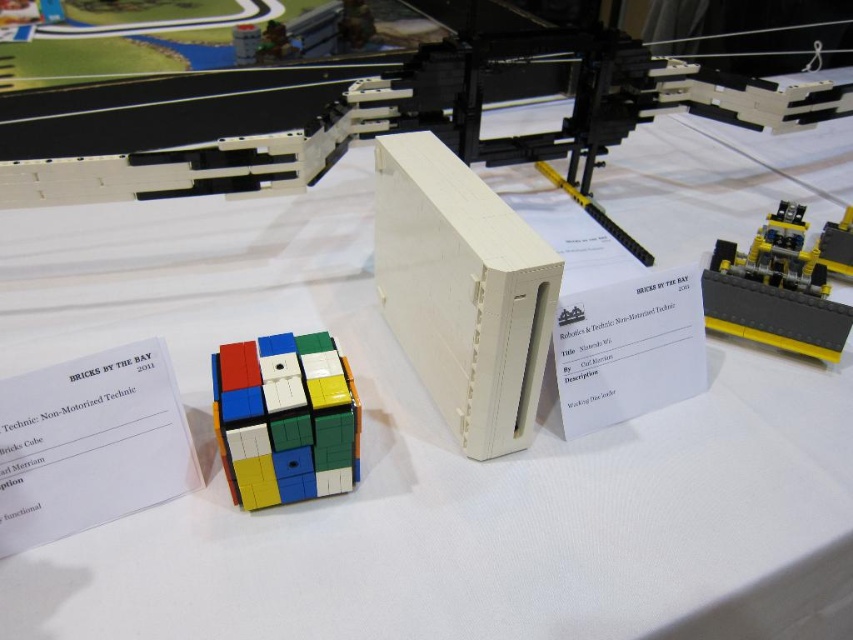
Based on the photo, you are a guest at the LEGO event and want to touch both the white matte rectangular block at center and the yellow plastic motor at upper right. Which object should you reach for first to touch the one closer to you?

The white matte rectangular block at center is closer to the viewer, so you should reach for it first before touching the yellow plastic motor at upper right.